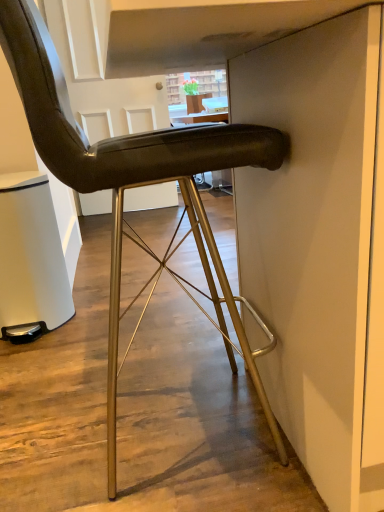
Measure the distance between white matte trash can at lower left and camera.

white matte trash can at lower left is 5.07 feet away from camera.

Identify the location of white matte trash can at lower left. This screenshot has width=384, height=512. (31, 255).

What do you see at coordinates (31, 255) in the screenshot? I see `white matte trash can at lower left` at bounding box center [31, 255].

The height and width of the screenshot is (512, 384). What do you see at coordinates (135, 183) in the screenshot?
I see `matte black chair at center` at bounding box center [135, 183].

The width and height of the screenshot is (384, 512). In order to click on matte black chair at center in this screenshot , I will do `click(135, 183)`.

What is the approximate height of matte black chair at center?

matte black chair at center is 3.48 feet in height.

In order to face matte black chair at center, should I rotate leftwards or rightwards?

Rotate your view left by about 6.923°.

The image size is (384, 512). What are the coordinates of `white matte trash can at lower left` in the screenshot? It's located at (31, 255).

Based on their positions, is matte black chair at center located to the left or right of white matte trash can at lower left?

matte black chair at center is positioned on white matte trash can at lower left's right side.

Which is behind, matte black chair at center or white matte trash can at lower left?

white matte trash can at lower left is further away from the camera.

Is point (263, 130) closer or farther from the camera than point (37, 247)?

Point (263, 130) is positioned closer to the camera compared to point (37, 247).

From the image's perspective, is matte black chair at center positioned above or below white matte trash can at lower left?

Based on their image positions, matte black chair at center is located above white matte trash can at lower left.

From a real-world perspective, is matte black chair at center physically located above or below white matte trash can at lower left?

Clearly, from a real-world perspective, matte black chair at center is above white matte trash can at lower left.

Considering the sizes of matte black chair at center and white matte trash can at lower left in the image, is matte black chair at center wider or thinner than white matte trash can at lower left?

Clearly, matte black chair at center has more width compared to white matte trash can at lower left.

Which of these two, matte black chair at center or white matte trash can at lower left, stands shorter?

With less height is white matte trash can at lower left.

Considering the relative sizes of matte black chair at center and white matte trash can at lower left in the image provided, is matte black chair at center bigger than white matte trash can at lower left?

Yes, matte black chair at center is bigger than white matte trash can at lower left.

Consider the image. Is matte black chair at center inside or outside of white matte trash can at lower left?

matte black chair at center cannot be found inside white matte trash can at lower left.

Is matte black chair at center placed right next to white matte trash can at lower left?

matte black chair at center and white matte trash can at lower left are clearly separated.

Is matte black chair at center oriented away from white matte trash can at lower left?

No, matte black chair at center's orientation is not away from white matte trash can at lower left.

How many degrees apart are the facing directions of matte black chair at center and white matte trash can at lower left?

There is a 89.3-degree angle between the facing directions of matte black chair at center and white matte trash can at lower left.

The height and width of the screenshot is (512, 384). Identify the location of chair in front of the white matte trash can at lower left. (135, 183).

Which is more to the right, white matte trash can at lower left or matte black chair at center?

matte black chair at center is more to the right.

Considering the positions of objects white matte trash can at lower left and matte black chair at center in the image provided, who is behind, white matte trash can at lower left or matte black chair at center?

white matte trash can at lower left is further away from the camera.

Is point (2, 180) positioned behind point (45, 34)?

That is True.

From the image's perspective, is white matte trash can at lower left above or below matte black chair at center?

white matte trash can at lower left is situated lower than matte black chair at center in the image.

From a real-world perspective, is white matte trash can at lower left above or below matte black chair at center?

white matte trash can at lower left is situated lower than matte black chair at center in the real world.

Based on the photo, considering the sizes of white matte trash can at lower left and matte black chair at center in the image, is white matte trash can at lower left wider or thinner than matte black chair at center?

white matte trash can at lower left is thinner than matte black chair at center.

Which of these two, white matte trash can at lower left or matte black chair at center, stands taller?

Standing taller between the two is matte black chair at center.

Is white matte trash can at lower left bigger than matte black chair at center?

No.

Can we say white matte trash can at lower left lies outside matte black chair at center?

Indeed, white matte trash can at lower left is completely outside matte black chair at center.

Is white matte trash can at lower left with matte black chair at center?

white matte trash can at lower left and matte black chair at center are not in contact.

Is white matte trash can at lower left oriented towards matte black chair at center?

No, white matte trash can at lower left does not turn towards matte black chair at center.

How different are the orientations of white matte trash can at lower left and matte black chair at center in degrees?

89.3 degrees separate the facing orientations of white matte trash can at lower left and matte black chair at center.

How distant is white matte trash can at lower left from matte black chair at center?

A distance of 24.38 inches exists between white matte trash can at lower left and matte black chair at center.

I want to click on cabinetry below the matte black chair at center (from a real-world perspective), so click(31, 255).

Identify the location of chair above the white matte trash can at lower left (from a real-world perspective). The image size is (384, 512). tap(135, 183).

You are a GUI agent. You are given a task and a screenshot of the screen. Output one action in this format:
    pyautogui.click(x=<x>, y=<y>)
    Task: Click on the cabinetry lying below the matte black chair at center (from the image's perspective)
    The image size is (384, 512).
    Given the screenshot: What is the action you would take?
    pyautogui.click(x=31, y=255)